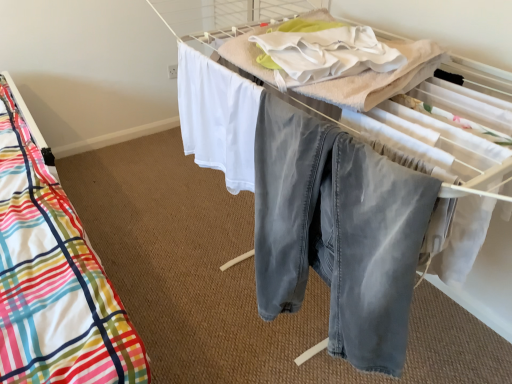
Identify the location of denim pants at center. (337, 232).

Identify the location of white cotton blanket at upper center. The width and height of the screenshot is (512, 384). (379, 78).

This screenshot has height=384, width=512. Find the location of `denim pants at center`. denim pants at center is located at coordinates (337, 232).

Measure the distance from plaid fabric bed at left to denim pants at center.

They are 20.05 centimeters apart.

Can you confirm if plaid fabric bed at left is shorter than denim pants at center?

No.

Which object is wider, plaid fabric bed at left or denim pants at center?

With larger width is plaid fabric bed at left.

Can you tell me how much plaid fabric bed at left and denim pants at center differ in facing direction?

They differ by 0.00225 degrees in their facing directions.

Is the position of white cotton blanket at upper center more distant than that of denim pants at center?

Yes, the depth of white cotton blanket at upper center is greater than that of denim pants at center.

From the picture: Can we say white cotton blanket at upper center lies outside denim pants at center?

Indeed, white cotton blanket at upper center is completely outside denim pants at center.

Are white cotton blanket at upper center and denim pants at center located far from each other?

They are positioned close to each other.

From the image's perspective, is denim pants at center located above white cotton blanket at upper center?

Actually, denim pants at center appears below white cotton blanket at upper center in the image.

Does denim pants at center have a greater height compared to white cotton blanket at upper center?

Yes, denim pants at center is taller than white cotton blanket at upper center.

Is denim pants at center at the left side of white cotton blanket at upper center?

Yes, denim pants at center is to the left of white cotton blanket at upper center.

Considering the sizes of objects denim pants at center and white cotton blanket at upper center in the image provided, who is bigger, denim pants at center or white cotton blanket at upper center?

denim pants at center is bigger.

From the picture: Is white cotton blanket at upper center to the left or to the right of plaid fabric bed at left in the image?

Clearly, white cotton blanket at upper center is on the right of plaid fabric bed at left in the image.

Between white cotton blanket at upper center and plaid fabric bed at left, which one has larger size?

Bigger between the two is plaid fabric bed at left.

From the image's perspective, who appears lower, white cotton blanket at upper center or plaid fabric bed at left?

From the image's view, plaid fabric bed at left is below.

Does white cotton blanket at upper center have a greater height compared to plaid fabric bed at left?

No.

From the image's perspective, does plaid fabric bed at left appear higher than white cotton blanket at upper center?

Actually, plaid fabric bed at left appears below white cotton blanket at upper center in the image.

Is the depth of plaid fabric bed at left less than that of white cotton blanket at upper center?

No, plaid fabric bed at left is further to the viewer.

Based on the photo, from a real-world perspective, is plaid fabric bed at left on white cotton blanket at upper center?

Incorrect, from a real-world perspective, plaid fabric bed at left is lower than white cotton blanket at upper center.

Is plaid fabric bed at left spatially inside white cotton blanket at upper center, or outside of it?

plaid fabric bed at left is spatially situated outside white cotton blanket at upper center.

Based on the photo, which object is wider, denim pants at center or plaid fabric bed at left?

With larger width is plaid fabric bed at left.

Is denim pants at center beside plaid fabric bed at left?

denim pants at center is not next to plaid fabric bed at left, and they're not touching.

Consider the image. In the image, is denim pants at center positioned in front of or behind plaid fabric bed at left?

In the image, denim pants at center appears in front of plaid fabric bed at left.

In order to click on bed that is above the denim pants at center (from the image's perspective) in this screenshot , I will do `click(441, 128)`.

Locate an element on the screen. trousers located on the right of plaid fabric bed at left is located at coordinates coord(337,232).

Identify the location of trousers below the white cotton blanket at upper center (from the image's perspective). The width and height of the screenshot is (512, 384). (337, 232).

From the image, which object appears to be farther from denim pants at center, plaid fabric bed at left or white cotton blanket at upper center?

white cotton blanket at upper center is further to denim pants at center.

Considering their positions, is white cotton blanket at upper center positioned closer to plaid fabric bed at left than denim pants at center?

The object closer to plaid fabric bed at left is white cotton blanket at upper center.

When comparing their distances from plaid fabric bed at left, does denim pants at center or white cotton blanket at upper center seem further?

denim pants at center lies further to plaid fabric bed at left than the other object.

Estimate the real-world distances between objects in this image. Which object is closer to denim pants at center, white cotton blanket at upper center or plaid fabric bed at left?

Based on the image, plaid fabric bed at left appears to be nearer to denim pants at center.

Estimate the real-world distances between objects in this image. Which object is closer to white cotton blanket at upper center, plaid fabric bed at left or denim pants at center?

Among the two, plaid fabric bed at left is located nearer to white cotton blanket at upper center.

When comparing their distances from white cotton blanket at upper center, does denim pants at center or plaid fabric bed at left seem further?

denim pants at center lies further to white cotton blanket at upper center than the other object.

Locate an element on the screen. bed between white cotton blanket at upper center and denim pants at center in the up-down direction is located at coordinates (441, 128).